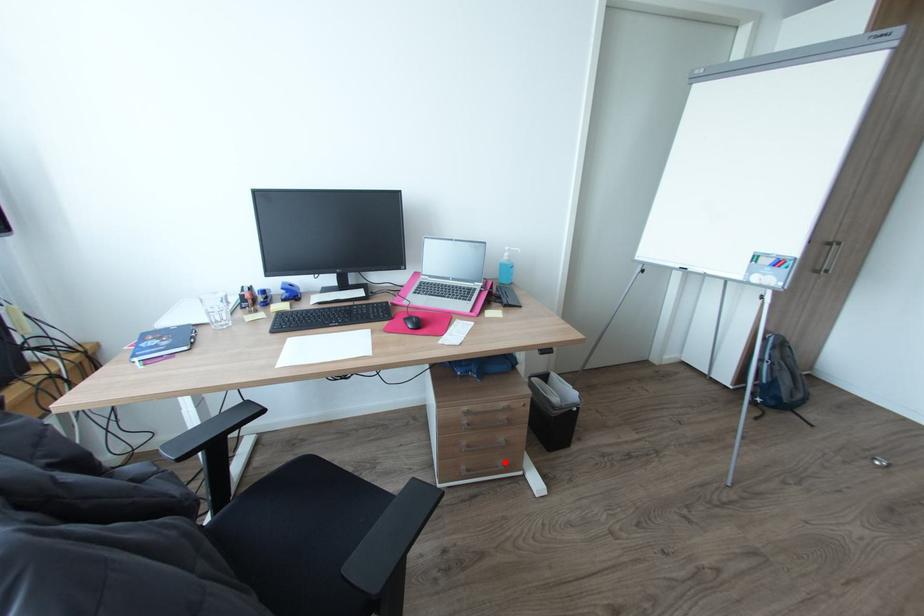
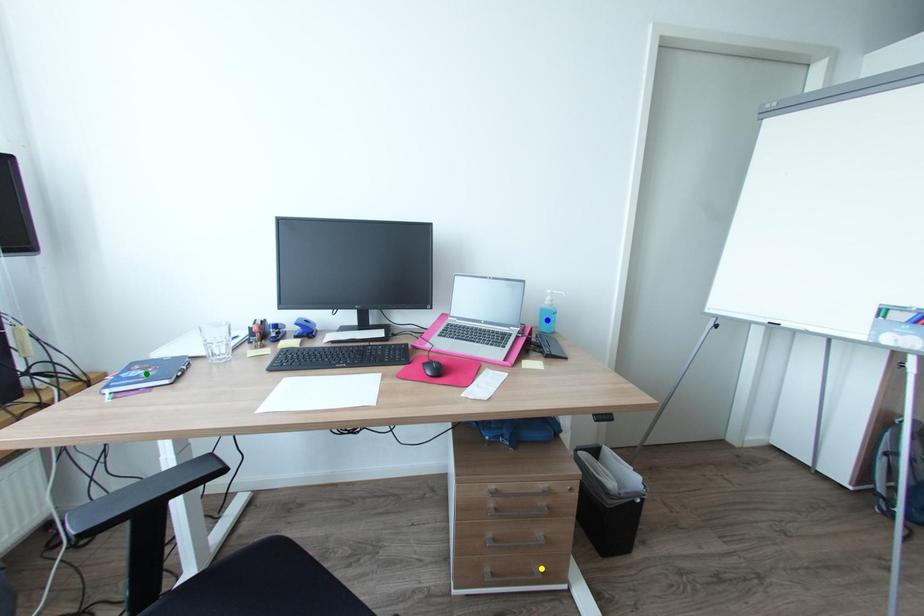
Question: I am providing you with two images of the same scene from different viewpoints. A red point is marked on the first image. You are given multiple points on the second image. In image 2, which mark is for the same physical point as the one in image 1?

Choices:
 (A) green point
 (B) blue point
 (C) yellow point

Answer: (C)